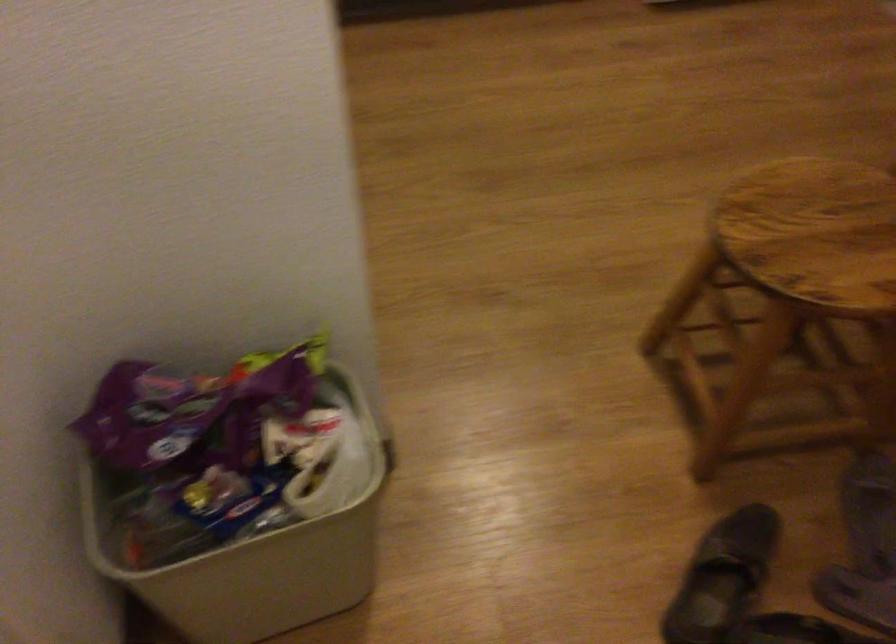
Find where to lift the beige plastic bin. Please return your answer as a coordinate pair (x, y).

(255, 554)